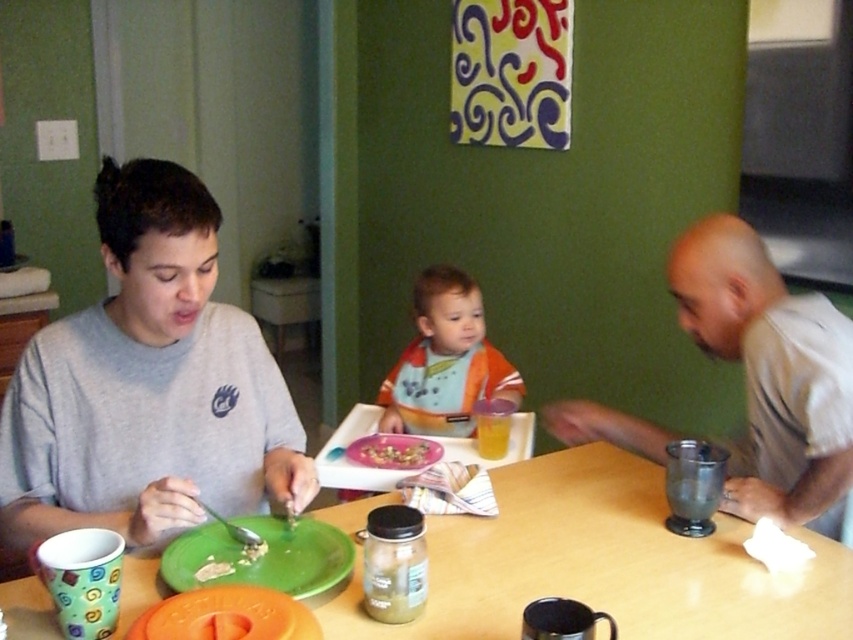
Question: Can you confirm if wooden table at center is smaller than metallic silver cup at right?

Choices:
 (A) yes
 (B) no

Answer: (A)

Question: Does green plastic plate at lower left have a smaller size compared to shiny plastic tray at center?

Choices:
 (A) yes
 (B) no

Answer: (B)

Question: Estimate the real-world distances between objects in this image. Which object is farther from the orange bibbed baby at center?

Choices:
 (A) metallic silver cup at right
 (B) gray matte shirt at left
 (C) shiny plastic tray at center

Answer: (B)

Question: Which object is positioned farthest from the wooden table at center?

Choices:
 (A) metallic silver cup at right
 (B) green plastic plate at lower left

Answer: (B)

Question: Considering the real-world distances, which object is closest to the orange bibbed baby at center?

Choices:
 (A) wooden table at center
 (B) shiny plastic tray at center
 (C) metallic silver cup at right

Answer: (B)

Question: Is green plastic plate at lower left below shiny plastic tray at center?

Choices:
 (A) yes
 (B) no

Answer: (A)